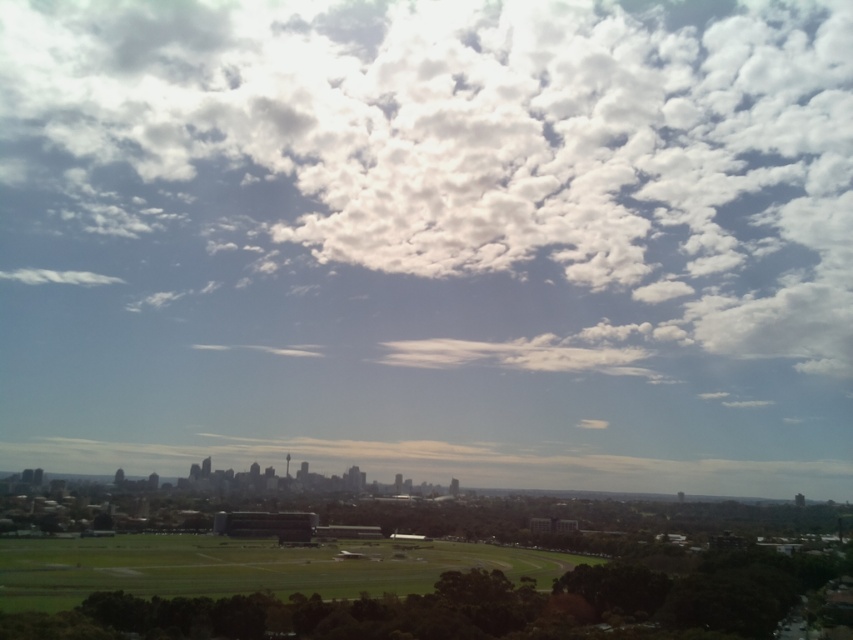
Can you confirm if white fluffy cloud at upper center is positioned to the left of green grassy field at lower center?

No, white fluffy cloud at upper center is not to the left of green grassy field at lower center.

Which of these two, white fluffy cloud at upper center or green grassy field at lower center, stands shorter?

With less height is green grassy field at lower center.

The width and height of the screenshot is (853, 640). In order to click on white fluffy cloud at upper center in this screenshot , I will do `click(485, 144)`.